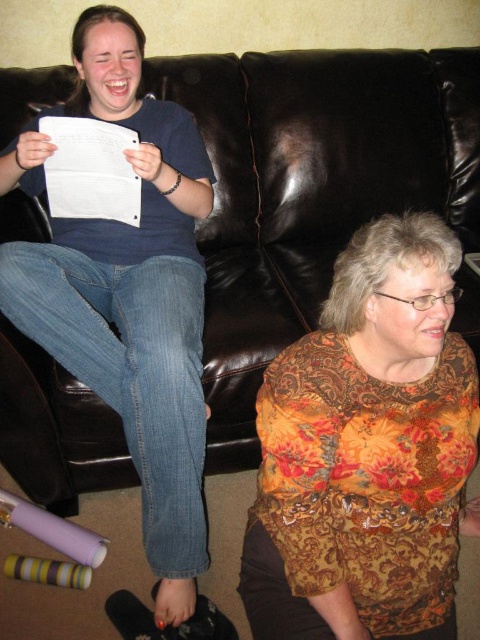
Question: Which point is closer to the camera?

Choices:
 (A) (259, 541)
 (B) (264, 301)

Answer: (A)

Question: Observing the image, what is the correct spatial positioning of floral-patterned blouse at center in reference to white paper at upper left?

Choices:
 (A) right
 (B) left

Answer: (A)

Question: Estimate the real-world distances between objects in this image. Which object is closer to the floral-patterned blouse at center?

Choices:
 (A) white paper at upper left
 (B) brown leather couch at center

Answer: (B)

Question: Which point is farther to the camera?

Choices:
 (A) brown leather couch at center
 (B) white paper at upper left

Answer: (B)

Question: Does brown leather couch at center appear on the left side of floral-patterned blouse at center?

Choices:
 (A) no
 (B) yes

Answer: (B)

Question: Is brown leather couch at center behind white paper at upper left?

Choices:
 (A) no
 (B) yes

Answer: (A)